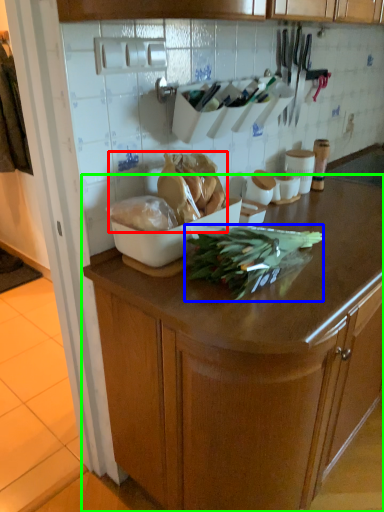
Question: Considering the real-world distances, which object is farthest from food (highlighted by a red box)? green vegetables (highlighted by a blue box) or cabinetry (highlighted by a green box)?

Choices:
 (A) green vegetables
 (B) cabinetry

Answer: (B)